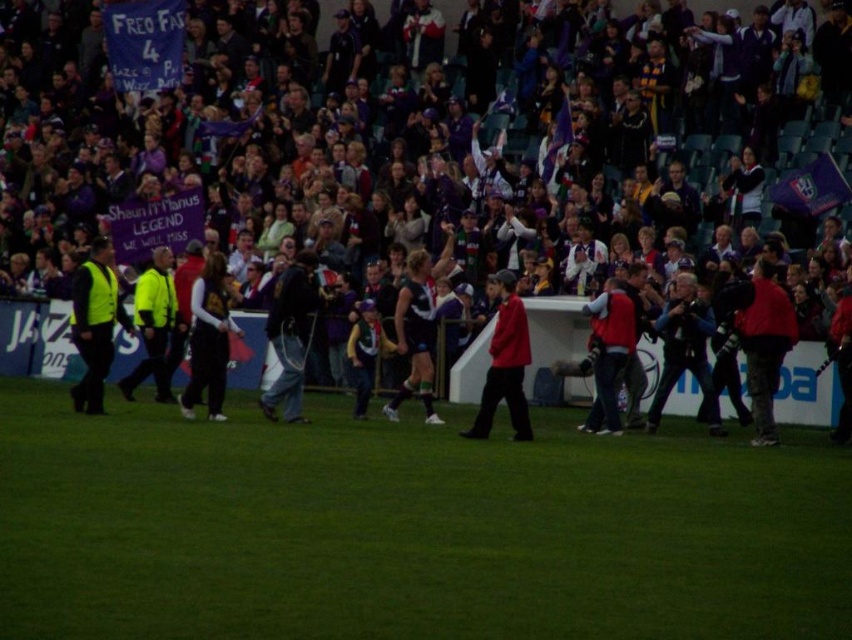
Question: Can you confirm if white jersey at center is positioned to the left of green grass at center?

Choices:
 (A) no
 (B) yes

Answer: (B)

Question: Is green grass at center closer to camera compared to dark gray fabric jacket at center?

Choices:
 (A) no
 (B) yes

Answer: (B)

Question: Considering the relative positions of green grass at center and dark gray fabric jacket at center in the image provided, where is green grass at center located with respect to dark gray fabric jacket at center?

Choices:
 (A) above
 (B) below

Answer: (B)

Question: Which point is farther to the camera?

Choices:
 (A) (55, 605)
 (B) (492, 381)

Answer: (B)

Question: Estimate the real-world distances between objects in this image. Which object is closer to the green grass at center?

Choices:
 (A) white jersey at center
 (B) red matte jacket at center
 (C) dark gray fabric jacket at center

Answer: (B)

Question: Which point is farther from the camera taking this photo?

Choices:
 (A) (108, 433)
 (B) (550, 68)

Answer: (B)